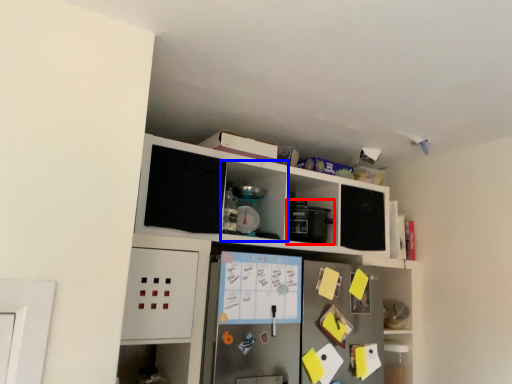
Question: Which point is further to the camera, appliance (highlighted by a red box) or cabinet (highlighted by a blue box)?

Choices:
 (A) appliance
 (B) cabinet

Answer: (A)